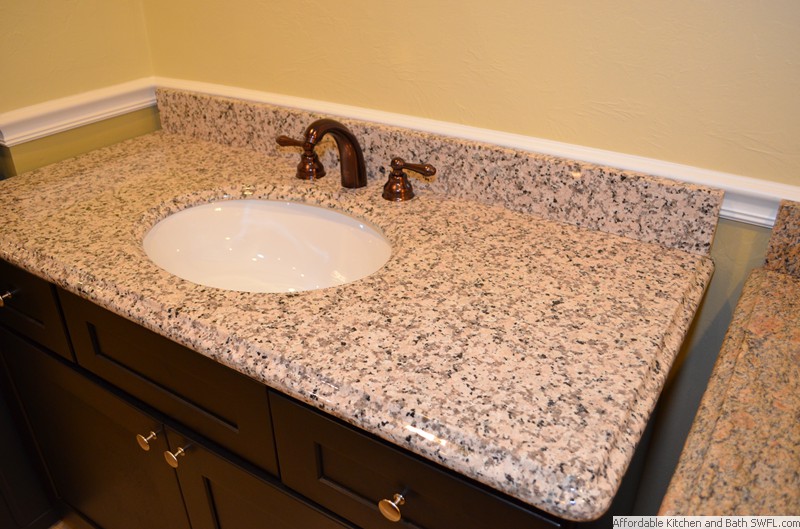
You are a GUI agent. You are given a task and a screenshot of the screen. Output one action in this format:
    pyautogui.click(x=<x>, y=<y>)
    Task: Click on the hot water handle
    The height and width of the screenshot is (529, 800).
    Given the screenshot: What is the action you would take?
    pyautogui.click(x=302, y=168)